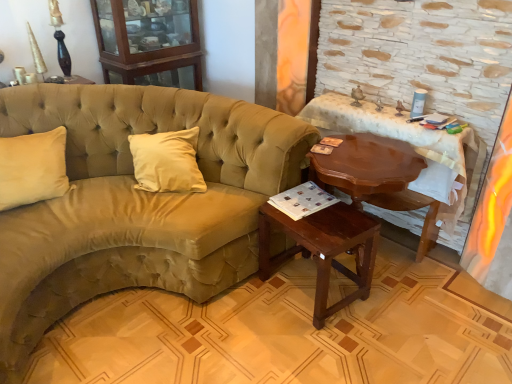
Where is `vacant area on top of mahogany wood table at right, the 2th table from the left (from a real-world perspective)`? The height and width of the screenshot is (384, 512). vacant area on top of mahogany wood table at right, the 2th table from the left (from a real-world perspective) is located at coordinates (399, 111).